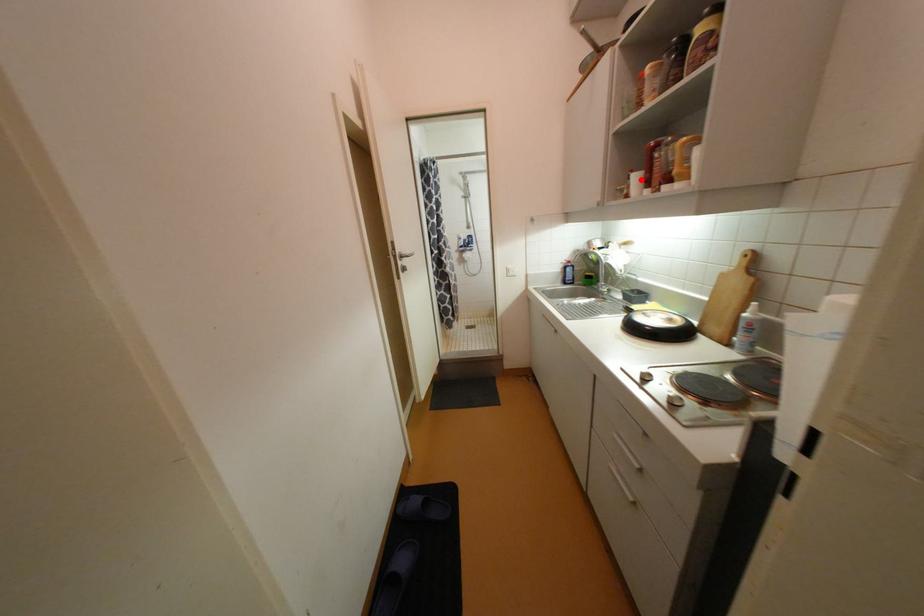
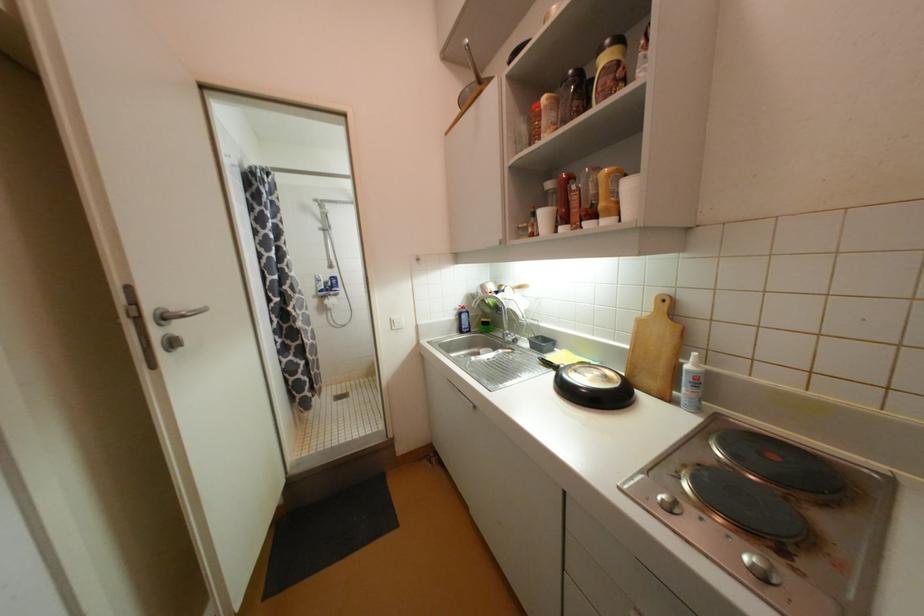
Question: I am providing you with two images of the same scene from different viewpoints. A red point is marked on the first image. At the location where the point appears in image 1, is it still visible in image 2?

Choices:
 (A) Yes
 (B) No

Answer: (A)